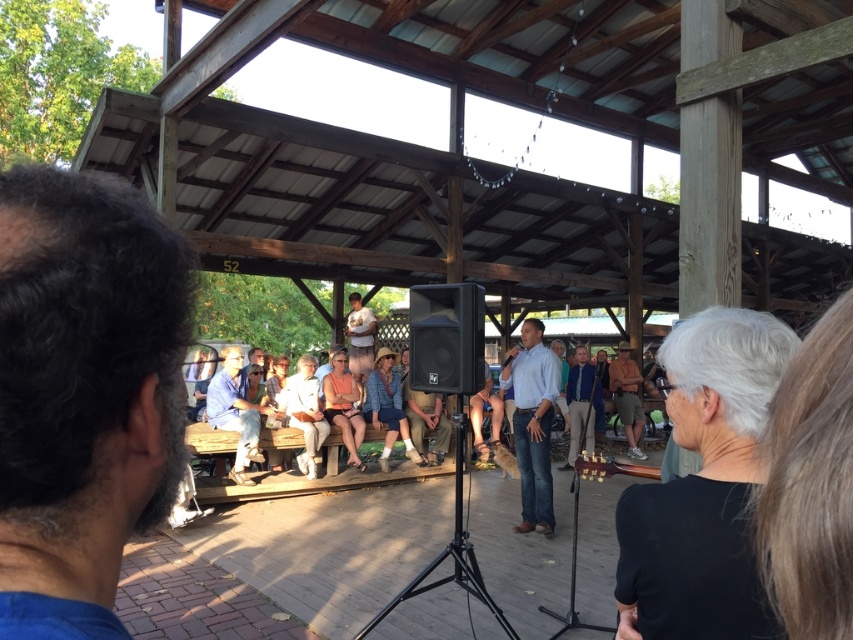
Question: Can you confirm if black matte speaker at center is wider than light brown wood shirt at center?

Choices:
 (A) no
 (B) yes

Answer: (A)

Question: Where is blue denim shirt at center located in relation to light brown wood shirt at center in the image?

Choices:
 (A) above
 (B) below

Answer: (B)

Question: Which object is positioned closest to the light brown wood shirt at center?

Choices:
 (A) blue jeans at center
 (B) gold wood guitar at lower center
 (C) blue denim shirt at center
 (D) dark brown hair at left

Answer: (A)

Question: Among these objects, which one is nearest to the camera?

Choices:
 (A) black matte speaker at center
 (B) dark brown hair at left
 (C) light brown wood shirt at center

Answer: (B)

Question: From the image, what is the correct spatial relationship of black matte speaker at center in relation to gold wood guitar at lower center?

Choices:
 (A) left
 (B) right

Answer: (A)

Question: Which point is farther to the camera?

Choices:
 (A) black matte speaker at center
 (B) dark brown hair at left
 (C) light brown wood shirt at center

Answer: (C)